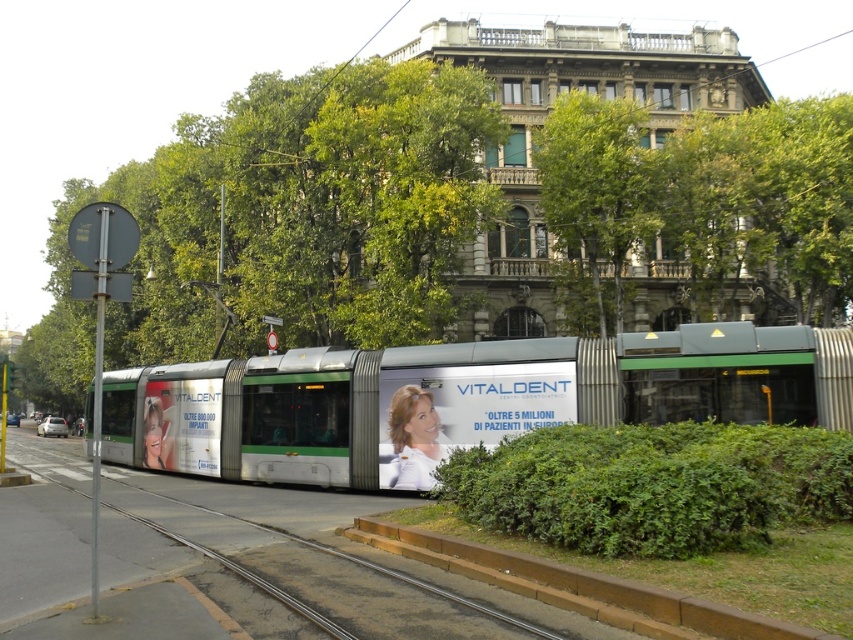
Is green metallic tram at center thinner than metal train track at center?

Incorrect, green metallic tram at center's width is not less than metal train track at center's.

Which of these two, green metallic tram at center or metal train track at center, stands shorter?

metal train track at center

Who is more forward, (619, 417) or (326, 609)?

Positioned in front is point (326, 609).

I want to click on green metallic tram at center, so click(x=460, y=397).